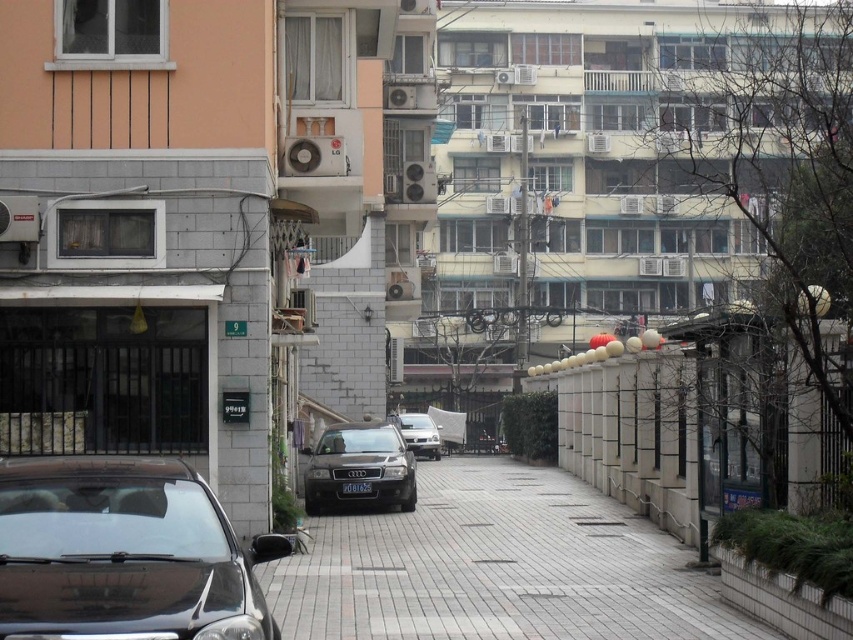
Question: Which point is closer to the camera taking this photo?

Choices:
 (A) (421, 445)
 (B) (700, 588)

Answer: (B)

Question: Is black glossy car at lower left behind sleek silver sedan at center?

Choices:
 (A) no
 (B) yes

Answer: (A)

Question: Is the position of black glossy car at lower left less distant than that of sleek silver sedan at center?

Choices:
 (A) no
 (B) yes

Answer: (B)

Question: Which object is closer to the camera taking this photo?

Choices:
 (A) satin gold car at center
 (B) black glossy car at lower left
 (C) gray brick pavement at center
 (D) sleek silver sedan at center

Answer: (B)

Question: Is gray brick pavement at center closer to the viewer compared to black glossy car at lower left?

Choices:
 (A) yes
 (B) no

Answer: (B)

Question: Among these points, which one is nearest to the camera?

Choices:
 (A) (508, 499)
 (B) (62, 620)
 (C) (409, 444)

Answer: (B)